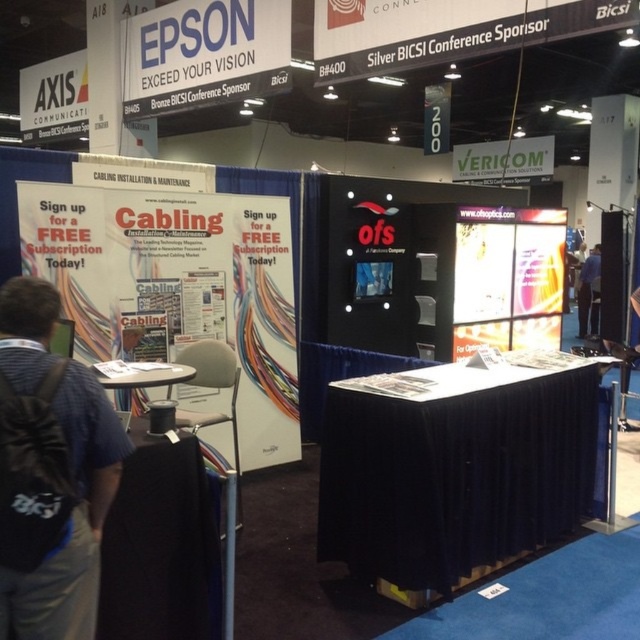
You are at the EPSON booth at BICSI Conference. You see a black fabric table at center and a black backpack at lower left. Which object is closer to you?

The black backpack at lower left is closer to you because it is positioned above the black fabric table at center.